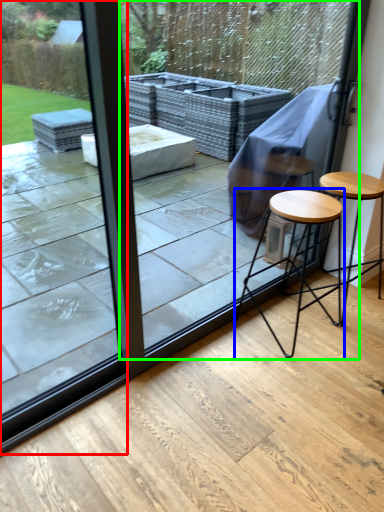
Question: Considering the real-world distances, which object is closest to glass door (highlighted by a red box)? stool (highlighted by a blue box) or screen door (highlighted by a green box).

Choices:
 (A) stool
 (B) screen door

Answer: (A)